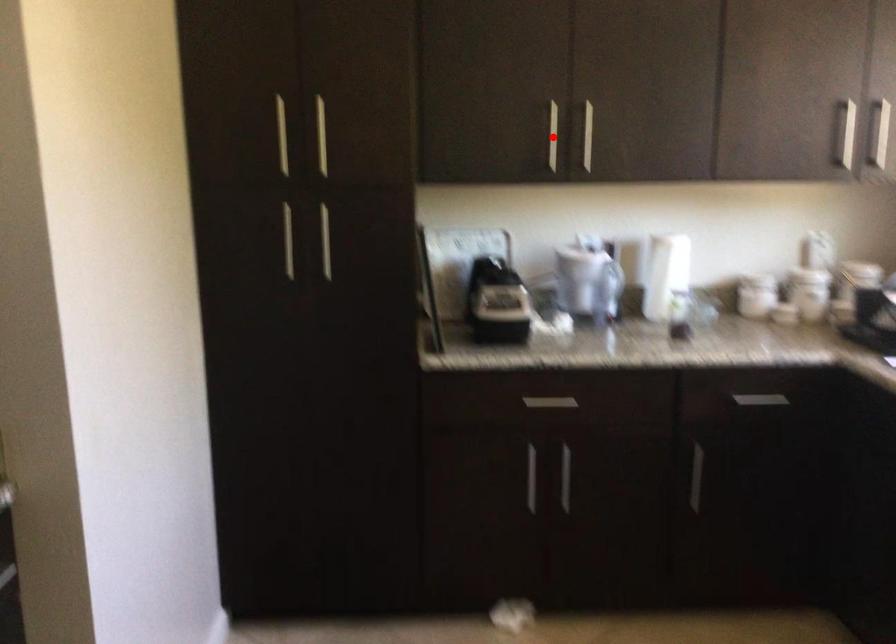
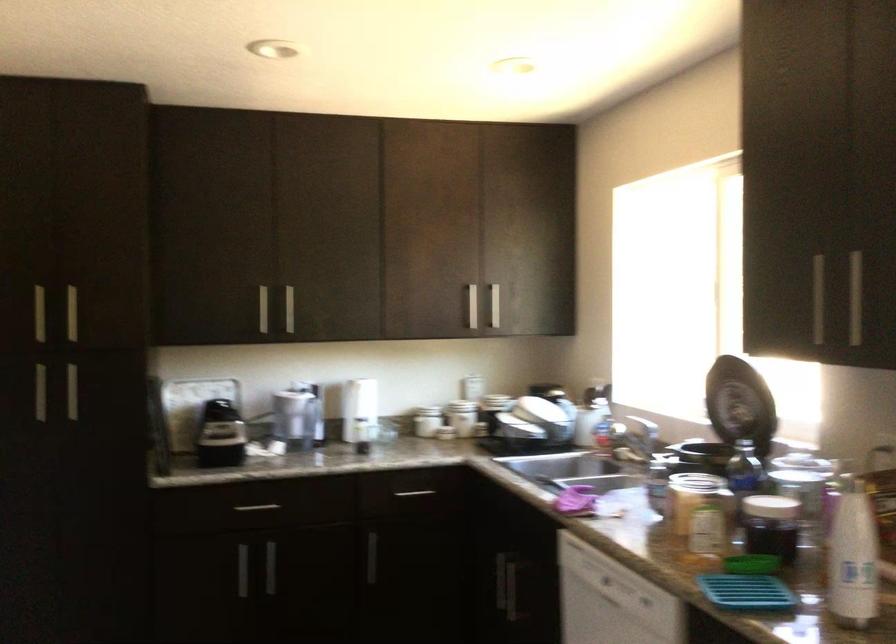
Locate, in the second image, the point that corresponds to the highlighted location in the first image.

(263, 308)